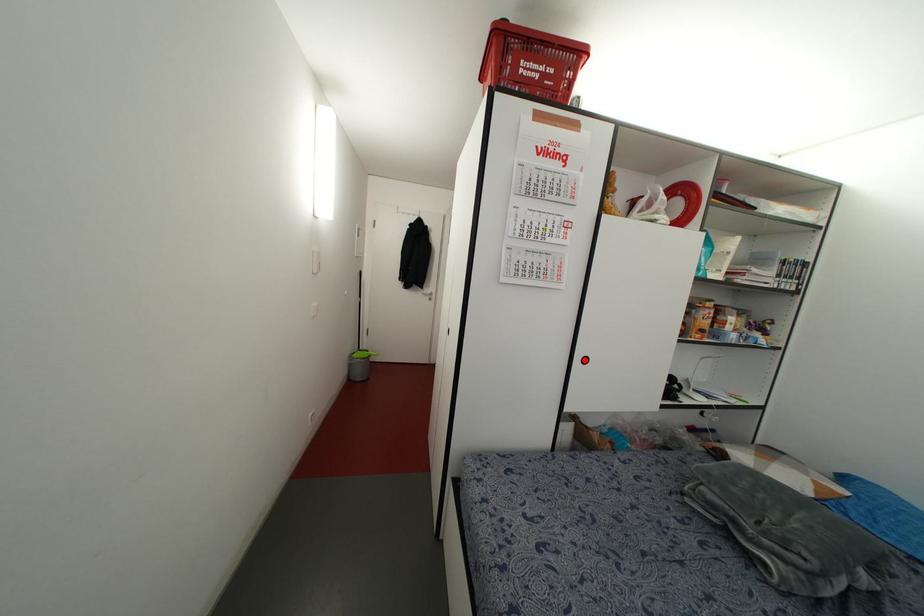
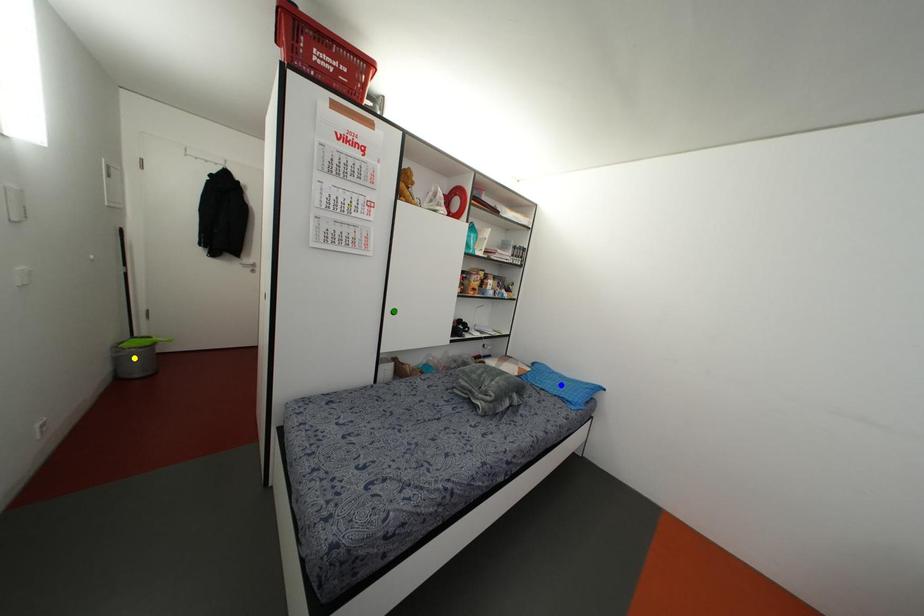
Question: I am providing you with two images of the same scene from different viewpoints. A red point is marked on the first image. You are given multiple points on the second image. Which mark in image 2 goes with the point in image 1?

Choices:
 (A) green point
 (B) blue point
 (C) yellow point

Answer: (A)